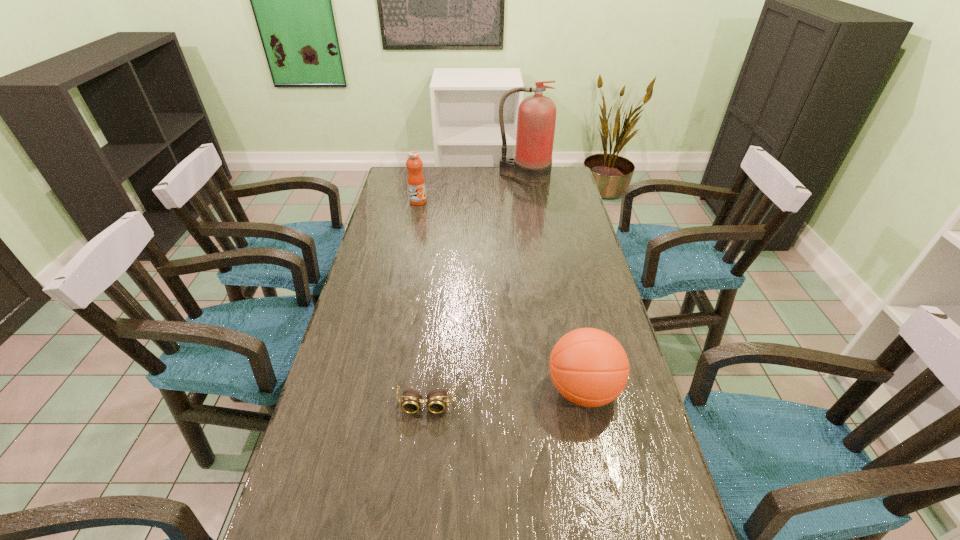
Locate an element on the screen. The height and width of the screenshot is (540, 960). vacant point located through the lenses of the second object from left to right is located at coordinates (420, 448).

Find the location of a particular element. object that is at the far edge is located at coordinates (531, 166).

Where is `object that is at the left edge`? object that is at the left edge is located at coordinates (416, 182).

You are a GUI agent. You are given a task and a screenshot of the screen. Output one action in this format:
    pyautogui.click(x=<x>, y=<y>)
    Task: Click on the fire extinguisher present at the right edge
    The width and height of the screenshot is (960, 540).
    Given the screenshot: What is the action you would take?
    pyautogui.click(x=531, y=166)

The width and height of the screenshot is (960, 540). I want to click on basketball at the right edge, so click(x=589, y=367).

This screenshot has width=960, height=540. I want to click on object that is at the far right corner, so point(531,166).

Identify the location of vacant space at the far edge of the desktop. (468, 186).

This screenshot has width=960, height=540. In order to click on vacant area at the left edge in this screenshot , I will do `click(393, 233)`.

This screenshot has height=540, width=960. Find the location of `vacant area at the right edge`. vacant area at the right edge is located at coordinates (558, 255).

In order to click on free location at the far left corner of the desktop in this screenshot , I will do `click(401, 179)`.